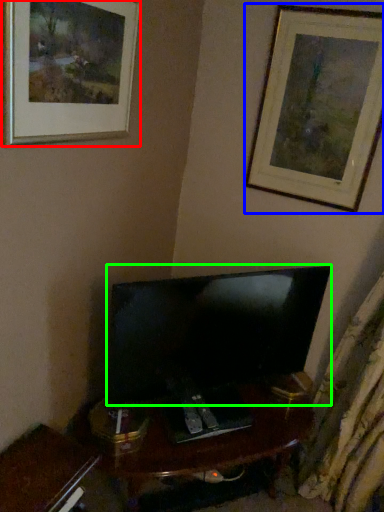
Question: Which object is positioned closest to picture frame (highlighted by a red box)? Select from picture frame (highlighted by a blue box) and television (highlighted by a green box).

Choices:
 (A) picture frame
 (B) television

Answer: (B)